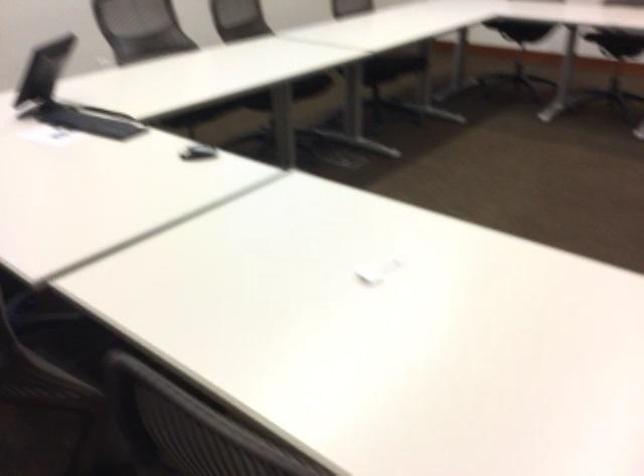
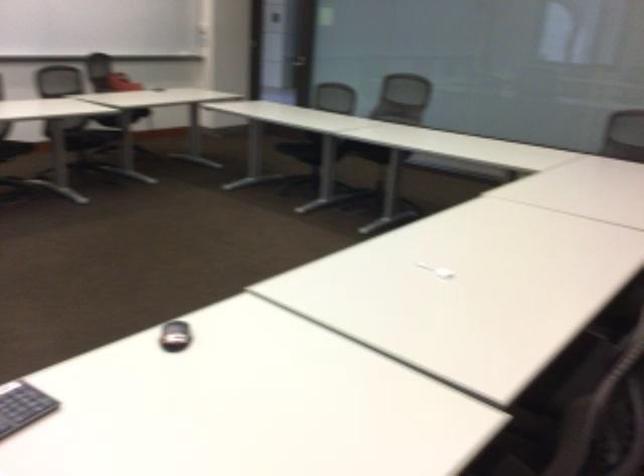
The images are taken continuously from a first-person perspective. In which direction is your viewpoint rotating?

The rotation direction of the camera is right-down.